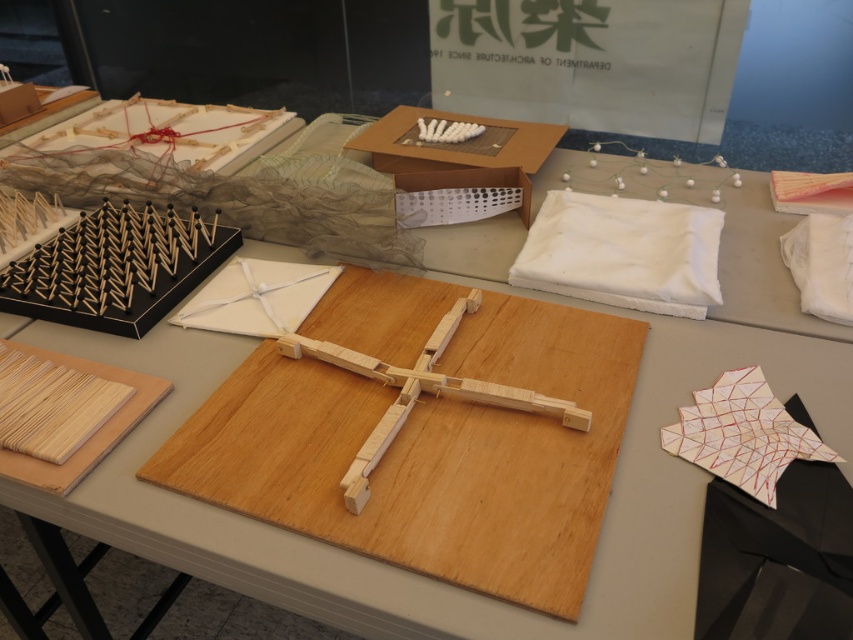
Between white fabric at upper right and matte cardboard box at center, which one appears on the left side from the viewer's perspective?

matte cardboard box at center is more to the left.

Image resolution: width=853 pixels, height=640 pixels. Identify the location of white fabric at upper right. (624, 252).

Is point (688, 307) more distant than point (494, 148)?

No, it is in front of (494, 148).

This screenshot has width=853, height=640. I want to click on white fabric at upper right, so click(624, 252).